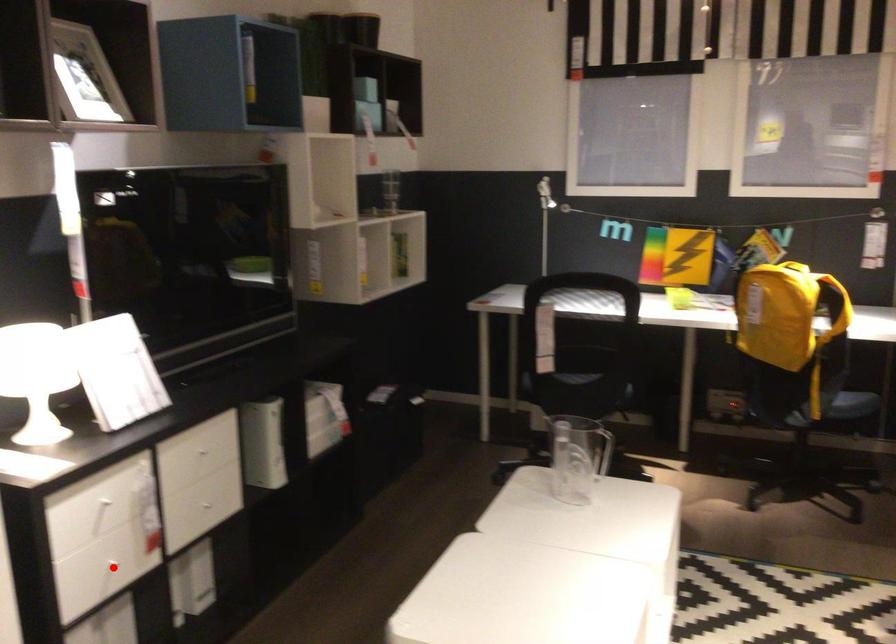
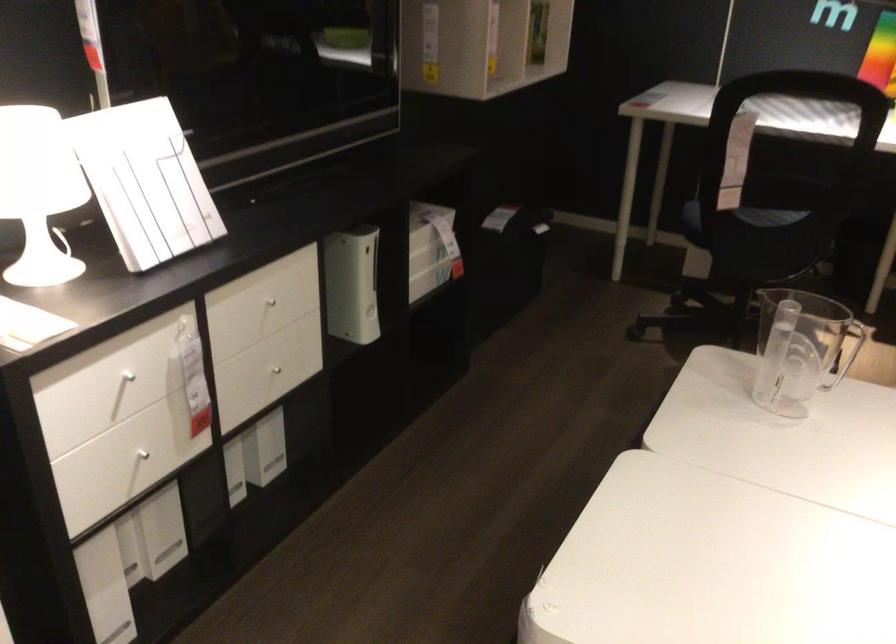
In the second image, find the point that corresponds to the highlighted location in the first image.

(142, 456)